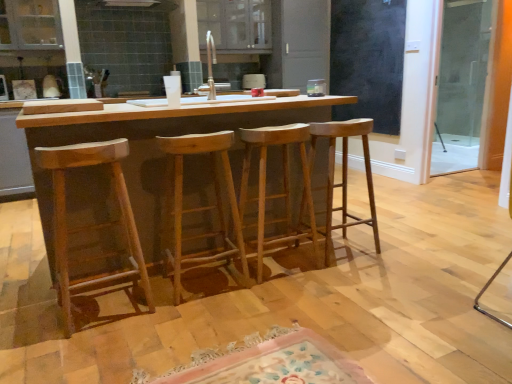
What is the approximate height of natural wood stool at center, which is the third stool from right to left?

natural wood stool at center, which is the third stool from right to left, is 32.11 inches in height.

Image resolution: width=512 pixels, height=384 pixels. Describe the element at coordinates (344, 175) in the screenshot. I see `natural wood stool at center, the 1th stool viewed from the right` at that location.

What do you see at coordinates (279, 193) in the screenshot? Image resolution: width=512 pixels, height=384 pixels. I see `natural wood stool at center, arranged as the third stool when viewed from the left` at bounding box center [279, 193].

This screenshot has height=384, width=512. Find the location of `natural wood stool at left, the 1th stool in the left-to-right sequence`. natural wood stool at left, the 1th stool in the left-to-right sequence is located at coordinates (93, 225).

Locate an element on the screen. The height and width of the screenshot is (384, 512). natural wood table at center is located at coordinates (154, 145).

Image resolution: width=512 pixels, height=384 pixels. I want to click on floral rug at lower center, so click(x=267, y=362).

Identify the location of transparent glass screen door at right, marked as the second screen door in a left-to-right arrangement. This screenshot has height=384, width=512. (x=461, y=84).

Find the location of a particular element. The height and width of the screenshot is (384, 512). natural wood stool at center, placed as the 2th stool when sorted from left to right is located at coordinates (199, 208).

Considering the sizes of white ceramic sink at center and transparent glass screen door at right, the 1th screen door in the right-to-left sequence, in the image, is white ceramic sink at center wider or thinner than transparent glass screen door at right, the 1th screen door in the right-to-left sequence,?

Considering their sizes, white ceramic sink at center looks broader than transparent glass screen door at right, the 1th screen door in the right-to-left sequence.

How far apart are white ceramic sink at center and transparent glass screen door at right, marked as the second screen door in a left-to-right arrangement?

They are 3.18 meters apart.

Considering the sizes of objects white ceramic sink at center and transparent glass screen door at right, marked as the second screen door in a left-to-right arrangement, in the image provided, who is shorter, white ceramic sink at center or transparent glass screen door at right, marked as the second screen door in a left-to-right arrangement,?

white ceramic sink at center is shorter.

Locate an element on the screen. This screenshot has width=512, height=384. screen door that appears below the white ceramic sink at center (from a real-world perspective) is located at coordinates (461, 84).

Which of these two, transparent glass screen door at right, the 1th screen door in the right-to-left sequence, or black matte screen door at upper right, which is the second screen door from right to left, stands shorter?

black matte screen door at upper right, which is the second screen door from right to left.

Is transparent glass screen door at right, the 1th screen door in the right-to-left sequence, smaller than black matte screen door at upper right, which is the second screen door from right to left?

Actually, transparent glass screen door at right, the 1th screen door in the right-to-left sequence, might be larger than black matte screen door at upper right, which is the second screen door from right to left.

Is transparent glass screen door at right, the 1th screen door in the right-to-left sequence, aimed at black matte screen door at upper right, which is the first screen door from left to right?

No, transparent glass screen door at right, the 1th screen door in the right-to-left sequence, is not turned towards black matte screen door at upper right, which is the first screen door from left to right.

How much distance is there between transparent glass screen door at right, marked as the second screen door in a left-to-right arrangement, and black matte screen door at upper right, which is the first screen door from left to right?

4.05 feet.

Considering the positions of objects white ceramic sink at center and natural wood stool at center, arranged as the third stool when viewed from the left, in the image provided, who is in front, white ceramic sink at center or natural wood stool at center, arranged as the third stool when viewed from the left,?

natural wood stool at center, arranged as the third stool when viewed from the left, is closer to the camera.

Considering the relative sizes of white ceramic sink at center and natural wood stool at center, which is the second stool from right to left, in the image provided, is white ceramic sink at center bigger than natural wood stool at center, which is the second stool from right to left,?

Yes.

From the picture: Is white ceramic sink at center turned away from natural wood stool at center, arranged as the third stool when viewed from the left?

white ceramic sink at center does not have its back to natural wood stool at center, arranged as the third stool when viewed from the left.

The width and height of the screenshot is (512, 384). I want to click on stool that is the 2nd one when counting downward from the white ceramic sink at center (from the image's perspective), so click(x=279, y=193).

Is point (245, 196) positioned after point (237, 256)?

No.

From a real-world perspective, between natural wood stool at center, which is the second stool from right to left, and natural wood stool at center, placed as the 2th stool when sorted from left to right, who is vertically higher?

natural wood stool at center, which is the second stool from right to left, is physically above.

Does floral rug at lower center come behind black matte screen door at upper right, which is the first screen door from left to right?

No, the depth of floral rug at lower center is less than that of black matte screen door at upper right, which is the first screen door from left to right.

Looking at this image, is floral rug at lower center placed right next to black matte screen door at upper right, which is the second screen door from right to left?

They are not placed beside each other.

Who is smaller, floral rug at lower center or black matte screen door at upper right, which is the first screen door from left to right?

Smaller between the two is floral rug at lower center.

Which object is positioned more to the left, natural wood table at center or white ceramic sink at center?

natural wood table at center.

Is natural wood table at center shorter than white ceramic sink at center?

No.

From the image's perspective, would you say natural wood table at center is shown under white ceramic sink at center?

Yes, from the image's perspective, natural wood table at center is below white ceramic sink at center.

Is natural wood table at center not near white ceramic sink at center?

natural wood table at center is near white ceramic sink at center, not far away.

Looking at this image, looking at their sizes, would you say natural wood stool at center, arranged as the third stool when viewed from the left, is wider or thinner than natural wood stool at left, the 4th stool when ordered from right to left?

natural wood stool at center, arranged as the third stool when viewed from the left, is thinner than natural wood stool at left, the 4th stool when ordered from right to left.

Consider the image. From the image's perspective, is natural wood stool at center, which is the second stool from right to left, over natural wood stool at left, the 1th stool in the left-to-right sequence?

Correct, natural wood stool at center, which is the second stool from right to left, appears higher than natural wood stool at left, the 1th stool in the left-to-right sequence, in the image.

In terms of height, does natural wood stool at center, arranged as the third stool when viewed from the left, look taller or shorter compared to natural wood stool at left, the 1th stool in the left-to-right sequence?

natural wood stool at center, arranged as the third stool when viewed from the left, is shorter than natural wood stool at left, the 1th stool in the left-to-right sequence.

Where is `the 2nd screen door to the right of the white ceramic sink at center, counting from the anchor's position`? This screenshot has width=512, height=384. the 2nd screen door to the right of the white ceramic sink at center, counting from the anchor's position is located at coordinates (461, 84).

Where is `screen door above the transparent glass screen door at right, the 1th screen door in the right-to-left sequence (from a real-world perspective)`? screen door above the transparent glass screen door at right, the 1th screen door in the right-to-left sequence (from a real-world perspective) is located at coordinates (368, 60).

From the image, which object appears to be farther from natural wood stool at center, placed as the fourth stool when sorted from left to right, black matte screen door at upper right, which is the first screen door from left to right, or transparent glass screen door at right, the 1th screen door in the right-to-left sequence?

transparent glass screen door at right, the 1th screen door in the right-to-left sequence, is positioned further to the anchor natural wood stool at center, placed as the fourth stool when sorted from left to right.

Considering their positions, is natural wood stool at left, the 1th stool in the left-to-right sequence, positioned further to natural wood table at center than white ceramic sink at center?

Among the two, white ceramic sink at center is located further to natural wood table at center.

Looking at the image, which one is located further to white ceramic sink at center, natural wood stool at center, which is the second stool from right to left, or natural wood stool at center, the 1th stool viewed from the right?

The object further to white ceramic sink at center is natural wood stool at center, the 1th stool viewed from the right.

From the image, which object appears to be nearer to floral rug at lower center, black matte screen door at upper right, which is the second screen door from right to left, or white ceramic sink at center?

white ceramic sink at center lies closer to floral rug at lower center than the other object.

Considering their positions, is natural wood stool at left, the 4th stool when ordered from right to left, positioned further to natural wood stool at center, placed as the fourth stool when sorted from left to right, than white ceramic sink at center?

natural wood stool at left, the 4th stool when ordered from right to left, is positioned further to the anchor natural wood stool at center, placed as the fourth stool when sorted from left to right.

Which object lies further to the anchor point natural wood stool at center, the 1th stool viewed from the right, natural wood stool at center, placed as the 2th stool when sorted from left to right, or natural wood table at center?

natural wood table at center is positioned further to the anchor natural wood stool at center, the 1th stool viewed from the right.

Based on their spatial positions, is transparent glass screen door at right, marked as the second screen door in a left-to-right arrangement, or natural wood stool at center, which is the third stool from right to left, closer to natural wood stool at left, the 4th stool when ordered from right to left?

natural wood stool at center, which is the third stool from right to left.

Estimate the real-world distances between objects in this image. Which object is closer to natural wood stool at left, the 4th stool when ordered from right to left, white ceramic sink at center or natural wood stool at center, the 1th stool viewed from the right?

Among the two, white ceramic sink at center is located nearer to natural wood stool at left, the 4th stool when ordered from right to left.

The width and height of the screenshot is (512, 384). In order to click on sink between natural wood stool at left, the 4th stool when ordered from right to left, and transparent glass screen door at right, the 1th screen door in the right-to-left sequence, from left to right in this screenshot , I will do `click(239, 95)`.

Image resolution: width=512 pixels, height=384 pixels. Find the location of `sink between natural wood table at center and black matte screen door at upper right, which is the first screen door from left to right, in the front-back direction`. sink between natural wood table at center and black matte screen door at upper right, which is the first screen door from left to right, in the front-back direction is located at coordinates (239, 95).

Image resolution: width=512 pixels, height=384 pixels. What are the coordinates of `sink between floral rug at lower center and transparent glass screen door at right, marked as the second screen door in a left-to-right arrangement, in the front-back direction` in the screenshot? It's located at (239, 95).

This screenshot has height=384, width=512. What are the coordinates of `table between natural wood stool at left, the 1th stool in the left-to-right sequence, and natural wood stool at center, arranged as the third stool when viewed from the left` in the screenshot? It's located at (154, 145).